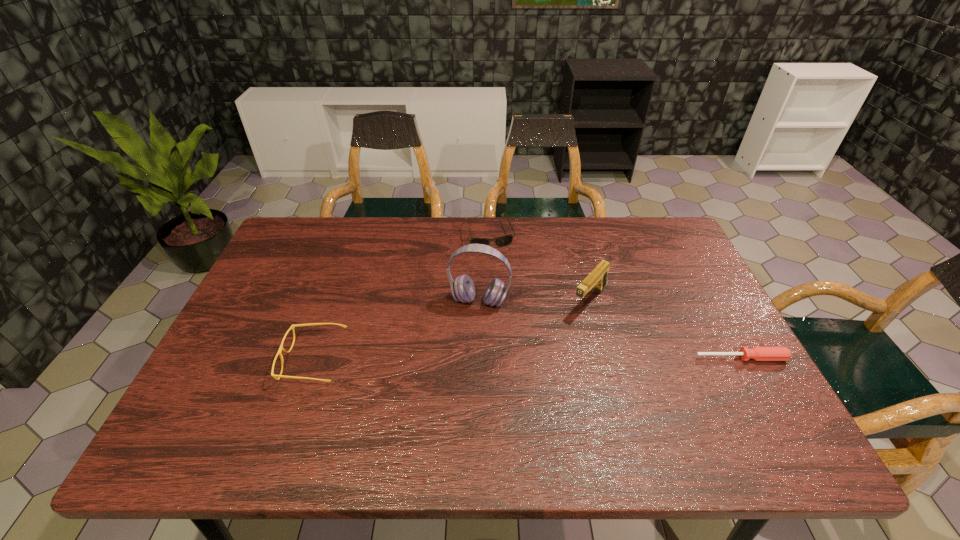
I want to click on spectacles, so click(x=281, y=348).

This screenshot has width=960, height=540. I want to click on the rightmost object, so click(x=756, y=353).

The width and height of the screenshot is (960, 540). Find the location of `screwdriver`. screwdriver is located at coordinates (756, 353).

This screenshot has height=540, width=960. I want to click on the fourth object from left to right, so click(597, 278).

The width and height of the screenshot is (960, 540). I want to click on pistol, so click(x=597, y=278).

Find the location of a particular element. sunglasses is located at coordinates (505, 240).

At what (x,y) coordinates should I click in order to perform the action: click on headset. Please return your answer as a coordinate pair (x, y). Looking at the image, I should click on (462, 289).

Where is `free space located 0.130m in front of the lenses of the spectacles`? free space located 0.130m in front of the lenses of the spectacles is located at coordinates (231, 361).

Locate an element on the screen. Image resolution: width=960 pixels, height=540 pixels. vacant area situated in front of the lenses of the spectacles is located at coordinates (240, 361).

Locate an element on the screen. The image size is (960, 540). free space located at the blade of the screwdriver is located at coordinates (x=768, y=406).